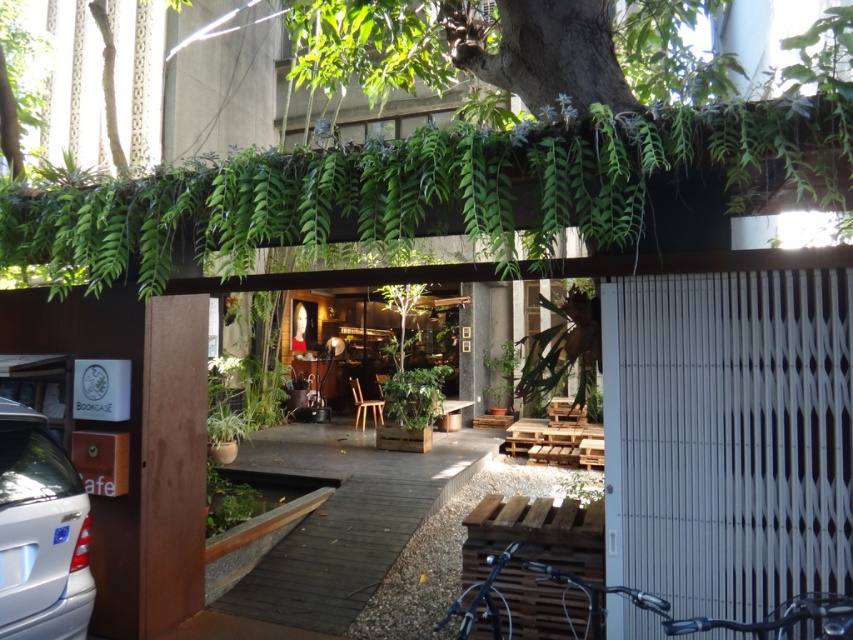
Question: Is shiny black bicycle at lower center positioned behind shiny metallic bicycle at lower right?

Choices:
 (A) yes
 (B) no

Answer: (A)

Question: Does silver metallic car at lower left lie in front of shiny metallic bicycle at lower right?

Choices:
 (A) no
 (B) yes

Answer: (A)

Question: Which point appears farthest from the camera in this image?

Choices:
 (A) (548, 577)
 (B) (474, 570)
 (C) (4, 436)

Answer: (B)

Question: Which of the following is the closest to the observer?

Choices:
 (A) shiny black bicycle at lower center
 (B) shiny metallic bicycle at lower right

Answer: (B)

Question: Does silver metallic car at lower left appear under shiny black bicycle at lower center?

Choices:
 (A) yes
 (B) no

Answer: (B)

Question: Which of the following is the closest to the observer?

Choices:
 (A) shiny metallic bicycle at lower right
 (B) silver metallic car at lower left

Answer: (A)